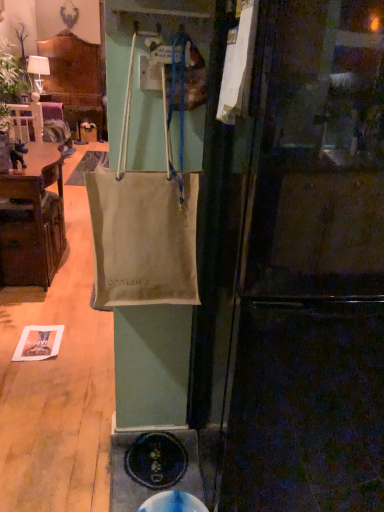
Question: Based on their sizes in the image, would you say matte black refrigerator at center is bigger or smaller than brown wood cabinet at left?

Choices:
 (A) small
 (B) big

Answer: (B)

Question: Is matte black refrigerator at center taller or shorter than brown wood cabinet at left?

Choices:
 (A) tall
 (B) short

Answer: (A)

Question: Considering the real-world distances, which object is closest to the blue rubber manhole cover at lower center?

Choices:
 (A) brown wood cabinet at left
 (B) matte black refrigerator at center
 (C) matte white lampshade at upper left
 (D) beige canvas bag at center

Answer: (B)

Question: Considering the real-world distances, which object is closest to the beige canvas bag at center?

Choices:
 (A) blue rubber manhole cover at lower center
 (B) matte white lampshade at upper left
 (C) brown wood cabinet at left
 (D) matte black refrigerator at center

Answer: (D)